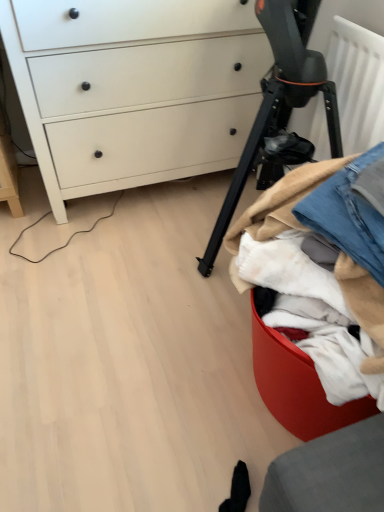
Question: From the image's perspective, is white matte chest of drawers at upper left over black matte tripod at center?

Choices:
 (A) no
 (B) yes

Answer: (B)

Question: Does white matte chest of drawers at upper left come behind black matte tripod at center?

Choices:
 (A) no
 (B) yes

Answer: (B)

Question: Is white matte chest of drawers at upper left aimed at black matte tripod at center?

Choices:
 (A) yes
 (B) no

Answer: (A)

Question: Could black matte tripod at center be considered to be inside white matte chest of drawers at upper left?

Choices:
 (A) no
 (B) yes

Answer: (A)

Question: Does white matte chest of drawers at upper left have a lesser width compared to black matte tripod at center?

Choices:
 (A) no
 (B) yes

Answer: (A)

Question: Can you confirm if white matte chest of drawers at upper left is wider than black matte tripod at center?

Choices:
 (A) no
 (B) yes

Answer: (B)

Question: Is denim fabric at right facing towards denim at right?

Choices:
 (A) no
 (B) yes

Answer: (A)

Question: Would you consider denim fabric at right to be distant from denim at right?

Choices:
 (A) yes
 (B) no

Answer: (B)

Question: Considering the relative sizes of denim fabric at right and denim at right in the image provided, is denim fabric at right taller than denim at right?

Choices:
 (A) yes
 (B) no

Answer: (A)

Question: Does denim fabric at right come in front of denim at right?

Choices:
 (A) no
 (B) yes

Answer: (B)

Question: Is denim fabric at right positioned behind denim at right?

Choices:
 (A) yes
 (B) no

Answer: (B)

Question: Is denim fabric at right surrounding denim at right?

Choices:
 (A) no
 (B) yes

Answer: (B)

Question: Is the surface of black matte tripod at center in direct contact with white matte chest of drawers at upper left?

Choices:
 (A) no
 (B) yes

Answer: (A)